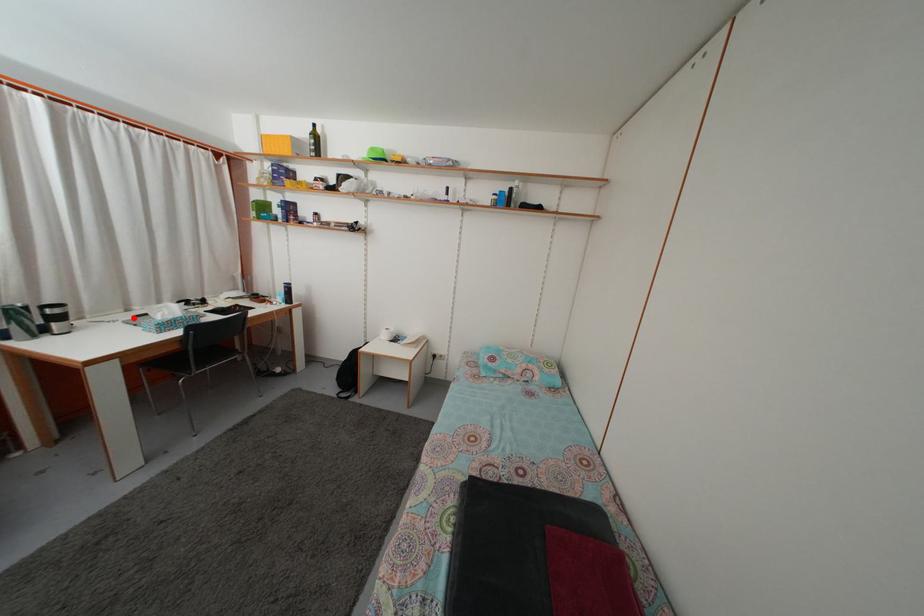
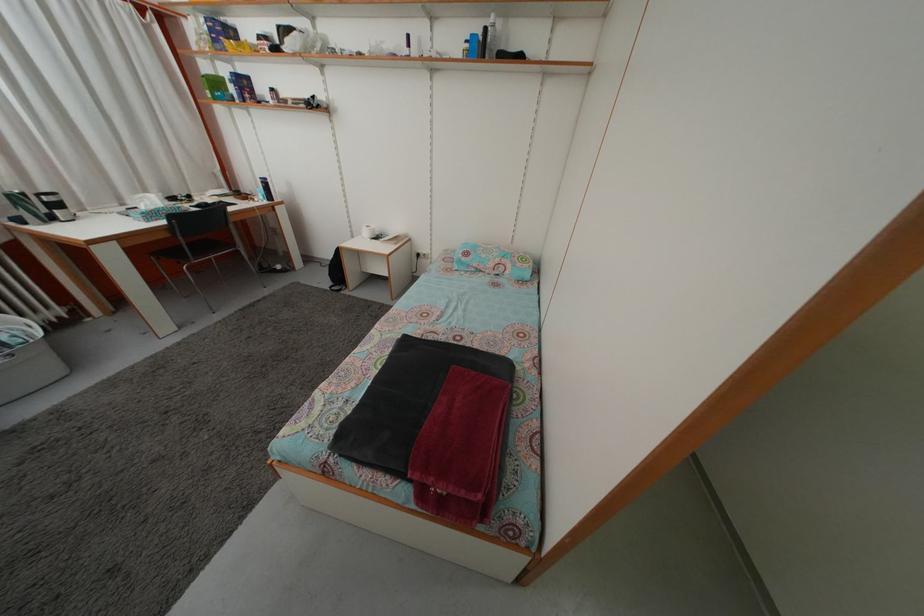
In the second image, find the point that corresponds to the highlighted location in the first image.

(128, 213)